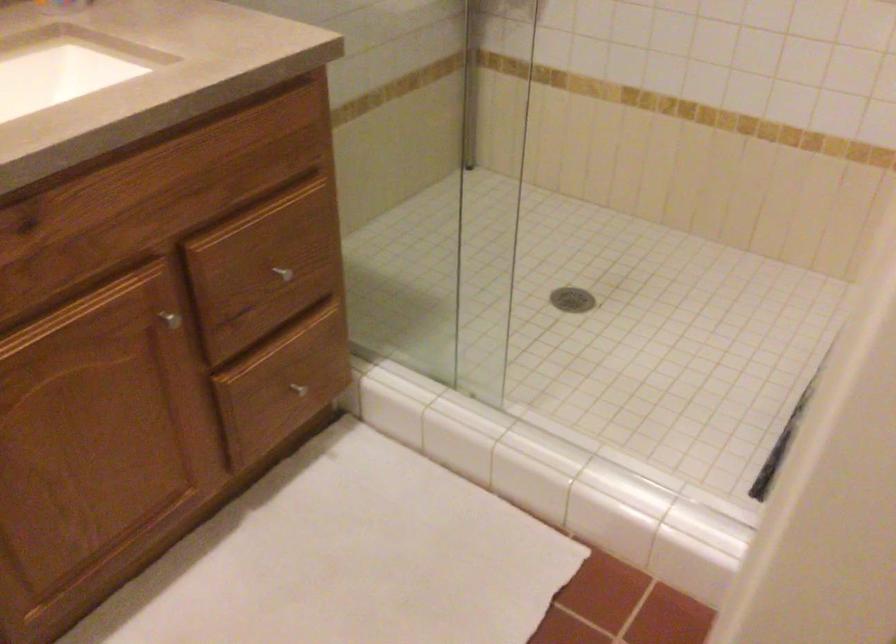
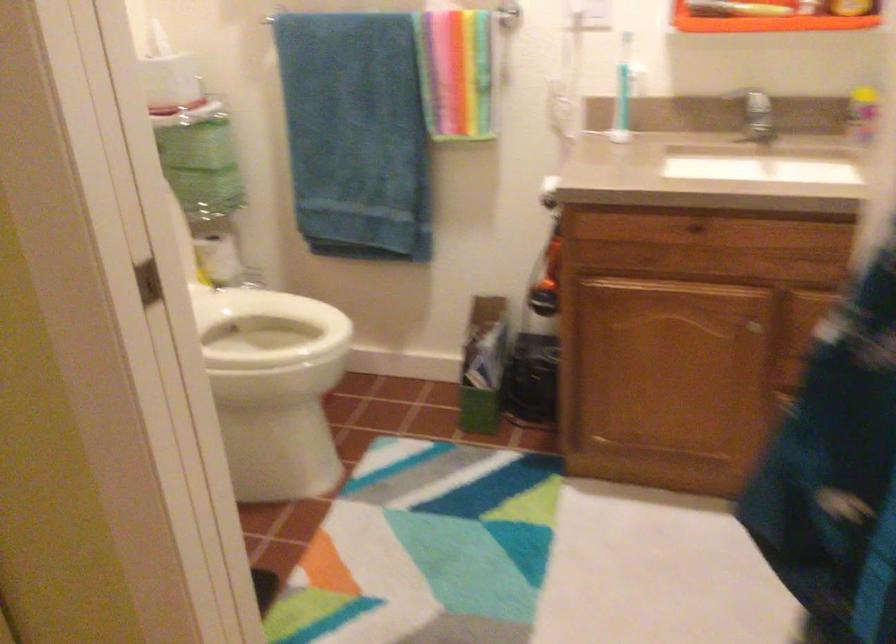
Question: The images are taken continuously from a first-person perspective. In which direction is your viewpoint rotating?

Choices:
 (A) Left
 (B) Right
 (C) Up
 (D) Down

Answer: (A)